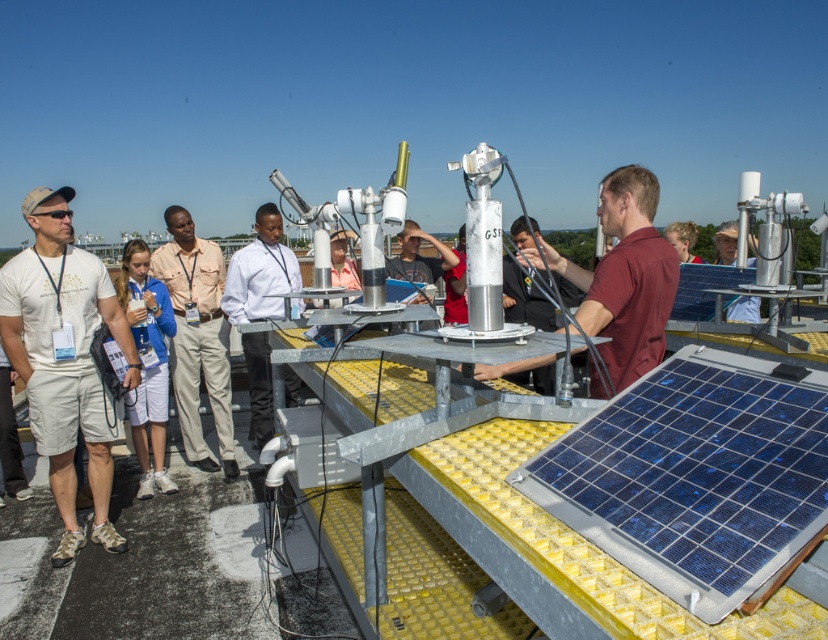
Question: Does tan/leather shirt at center appear on the left side of matte gray shirt at center?

Choices:
 (A) yes
 (B) no

Answer: (A)

Question: Is white shirt at center further to camera compared to matte gray shirt at center?

Choices:
 (A) yes
 (B) no

Answer: (B)

Question: Among these objects, which one is nearest to the camera?

Choices:
 (A) white shirt at center
 (B) tan/leather shirt at center
 (C) maroon shirt at center

Answer: (C)

Question: Does maroon shirt at center appear on the left side of tan/leather shirt at center?

Choices:
 (A) no
 (B) yes

Answer: (A)

Question: Which point is farther from the camera taking this photo?

Choices:
 (A) click(164, 276)
 (B) click(416, 246)
 (C) click(609, 218)

Answer: (B)

Question: Based on their relative distances, which object is nearer to the tan/leather shirt at center?

Choices:
 (A) white shirt at center
 (B) matte gray shirt at center

Answer: (A)